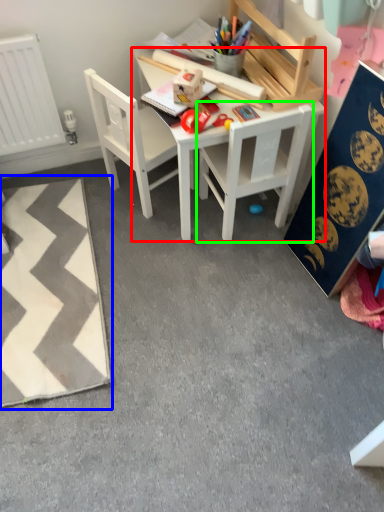
Question: Which object is the closest to the table (highlighted by a red box)? Choose among these: mat (highlighted by a blue box) or chair (highlighted by a green box).

Choices:
 (A) mat
 (B) chair

Answer: (B)